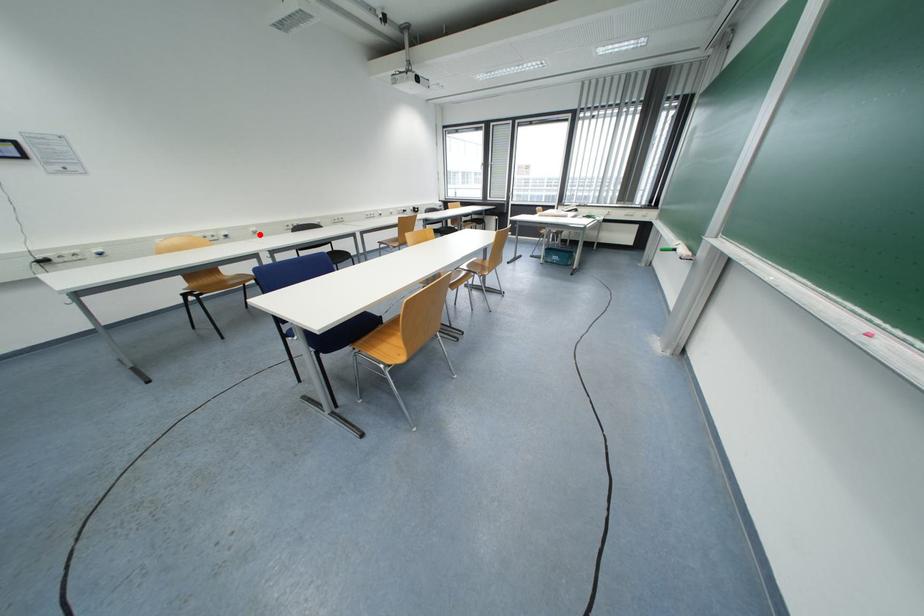
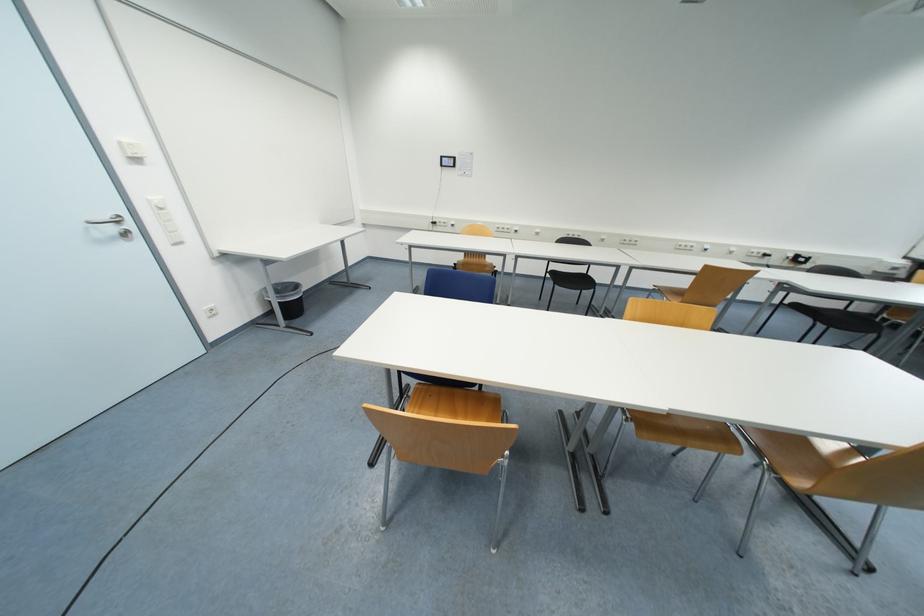
Question: I am providing you with two images of the same scene from different viewpoints. A red point is shown in image1. For the corresponding object point in image2, is it positioned nearer or farther from the camera?

Choices:
 (A) Nearer
 (B) Farther

Answer: (B)